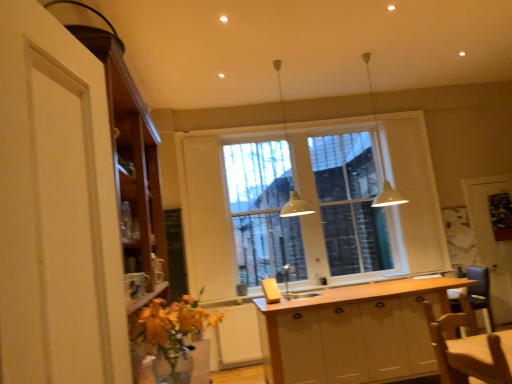
This screenshot has width=512, height=384. In order to click on free point above white matte pendant light at upper center, which is the second light fixture from left to right (from a real-world perspective) in this screenshot , I will do `click(362, 57)`.